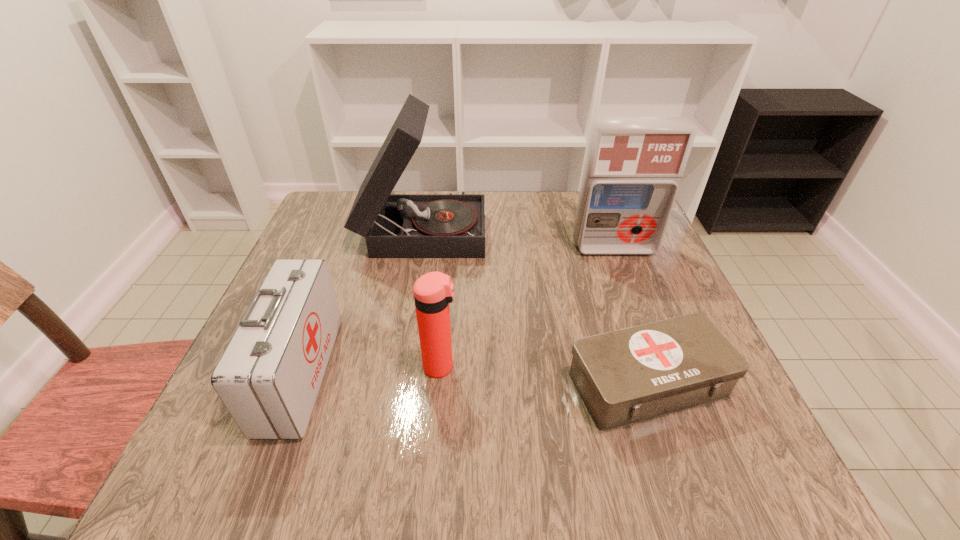
The height and width of the screenshot is (540, 960). What are the coordinates of `vacant area that lies between the shortest first-aid kit and the tallest first-aid kit` in the screenshot? It's located at (631, 316).

Identify the location of free space between the phonograph_record and the shortest object. (536, 306).

The width and height of the screenshot is (960, 540). I want to click on object that is the second closest to the shortest object, so click(x=633, y=166).

At what (x,y) coordinates should I click in order to perform the action: click on object that is the third closest to the farthest first-aid kit. Please return your answer as a coordinate pair (x, y). This screenshot has height=540, width=960. Looking at the image, I should click on (433, 291).

Identify which first-aid kit is the second closest to the farthest first-aid kit. Please provide its 2D coordinates. Your answer should be formatted as a tuple, i.e. [(x, y)], where the tuple contains the x and y coordinates of a point satisfying the conditions above.

[(268, 378)]

In order to click on the first-aid kit identified as the closest to the shortest first-aid kit in this screenshot , I will do `click(633, 166)`.

Identify the location of free spot that satisfies the following two spatial constraints: 1. on the back side of the thermos bottle; 2. on the front-facing side of the phonograph_record. This screenshot has width=960, height=540. (452, 229).

Identify the location of vacant point that satisfies the following two spatial constraints: 1. on the front-facing side of the shortest object; 2. on the right side of the phonograph_record. The height and width of the screenshot is (540, 960). (397, 383).

The width and height of the screenshot is (960, 540). What are the coordinates of `blank area in the image that satisfies the following two spatial constraints: 1. on the back side of the third shortest object; 2. on the front-facing side of the phonograph_record` in the screenshot? It's located at (452, 229).

This screenshot has height=540, width=960. I want to click on free location that satisfies the following two spatial constraints: 1. on the front-facing side of the phonograph_record; 2. on the back side of the third tallest object, so click(x=400, y=366).